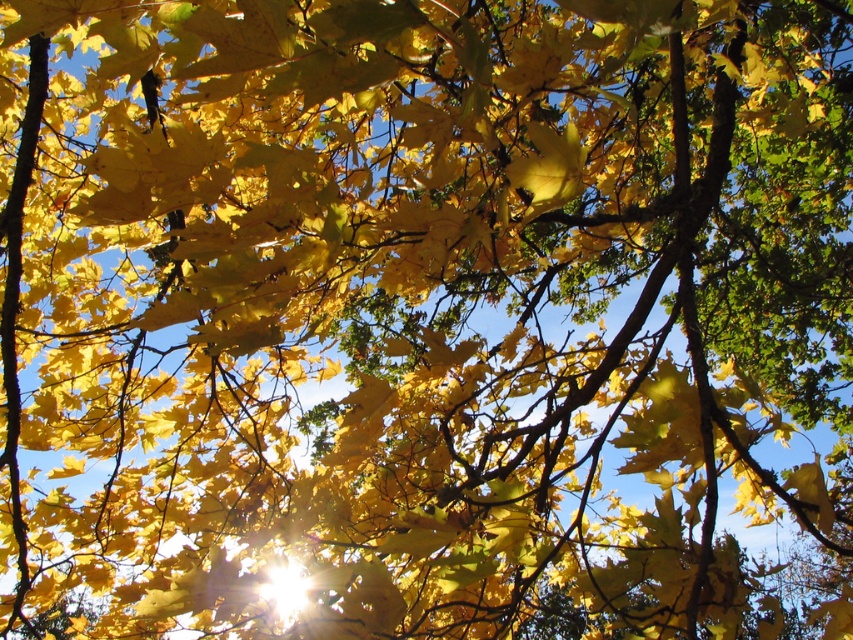
Question: Can you confirm if yellow matte leaf at upper left is bigger than yellow matte leaf at center?

Choices:
 (A) no
 (B) yes

Answer: (B)

Question: Among these points, which one is nearest to the camera?

Choices:
 (A) (180, 156)
 (B) (556, 177)

Answer: (A)

Question: Which object is farther from the camera taking this photo?

Choices:
 (A) yellow matte leaf at center
 (B) yellow matte leaf at upper left

Answer: (B)

Question: Is yellow matte leaf at upper left to the right of yellow matte leaf at center from the viewer's perspective?

Choices:
 (A) no
 (B) yes

Answer: (A)

Question: Can you confirm if yellow matte leaf at upper left is positioned below yellow matte leaf at center?

Choices:
 (A) yes
 (B) no

Answer: (B)